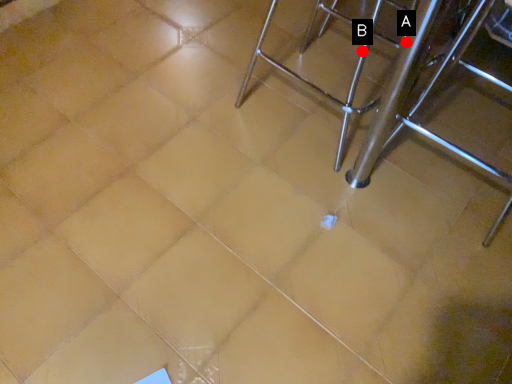
Question: Two points are circled on the image, labeled by A and B beside each circle. Which point appears farthest from the camera in this image?

Choices:
 (A) A is further
 (B) B is further

Answer: (B)